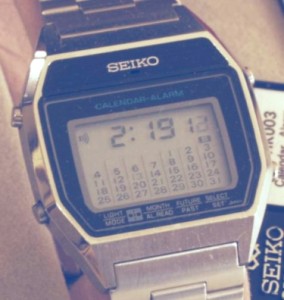
Image resolution: width=284 pixels, height=300 pixels. Find the location of `screen`. screen is located at coordinates (97, 151).